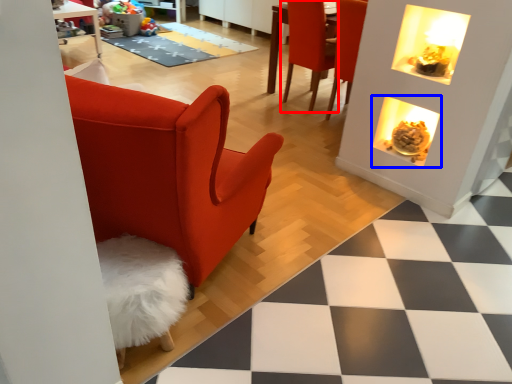
Question: Which object is closer to the camera taking this photo, chair (highlighted by a red box) or fireplace (highlighted by a blue box)?

Choices:
 (A) chair
 (B) fireplace

Answer: (B)